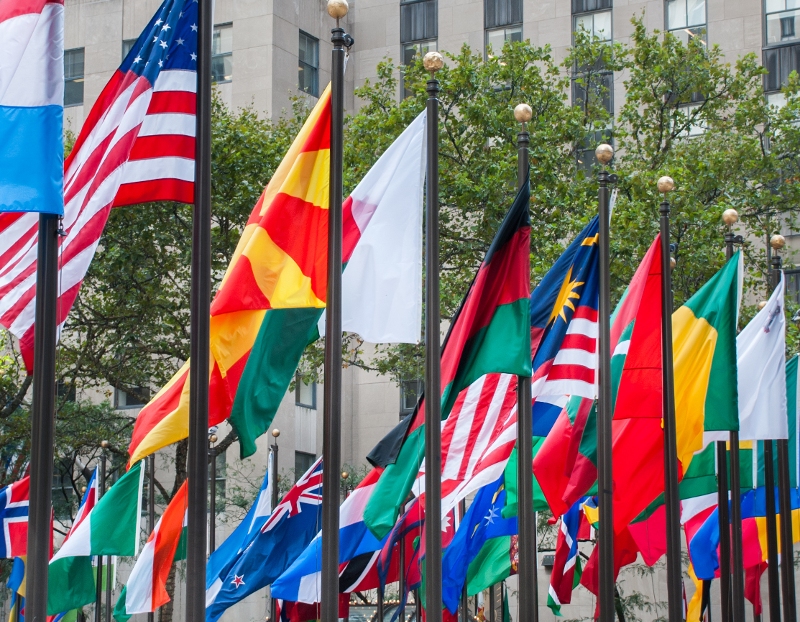
At what (x,y) coordinates should I click in order to perform the action: click on window panes. Please return your answer as a coordinate pair (x, y). Looking at the image, I should click on (221, 63), (132, 44), (78, 58), (309, 62), (404, 21), (504, 14), (586, 7), (678, 14), (774, 47), (780, 30).